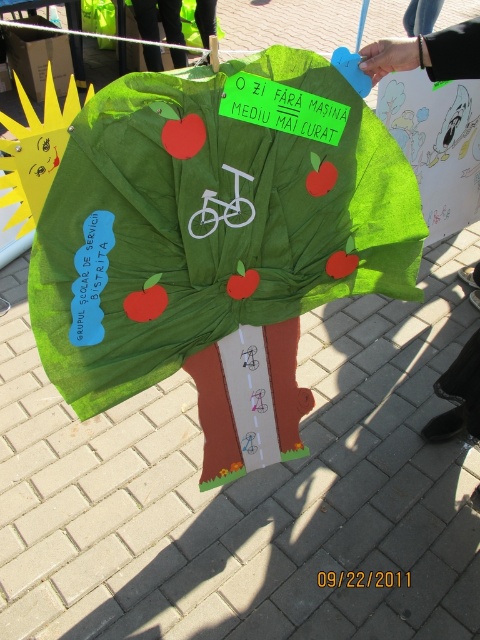
Is point (249, 97) positioned in front of point (460, 77)?

Yes, point (249, 97) is in front of point (460, 77).

Does point (204, 317) come behind point (439, 51)?

Yes, point (204, 317) is farther from viewer.

At what (x,y) coordinates should I click in order to perform the action: click on green fabric umbrella at center. Please return your answer as a coordinate pair (x, y). Looking at the image, I should click on (216, 234).

The image size is (480, 640). Identify the location of green fabric umbrella at center. (216, 234).

Describe the element at coordinates (216, 234) in the screenshot. I see `green fabric umbrella at center` at that location.

Which is in front, point (265, 241) or point (151, 4)?

Point (265, 241) is in front.

This screenshot has width=480, height=640. Find the location of `green fabric umbrella at center`. green fabric umbrella at center is located at coordinates (216, 234).

Does black fabric handbag at upper right have a smaller size compared to green fabric at center?

Yes, black fabric handbag at upper right is smaller than green fabric at center.

Can you confirm if black fabric handbag at upper right is wider than green fabric at center?

No.

The width and height of the screenshot is (480, 640). I want to click on black fabric handbag at upper right, so click(428, 52).